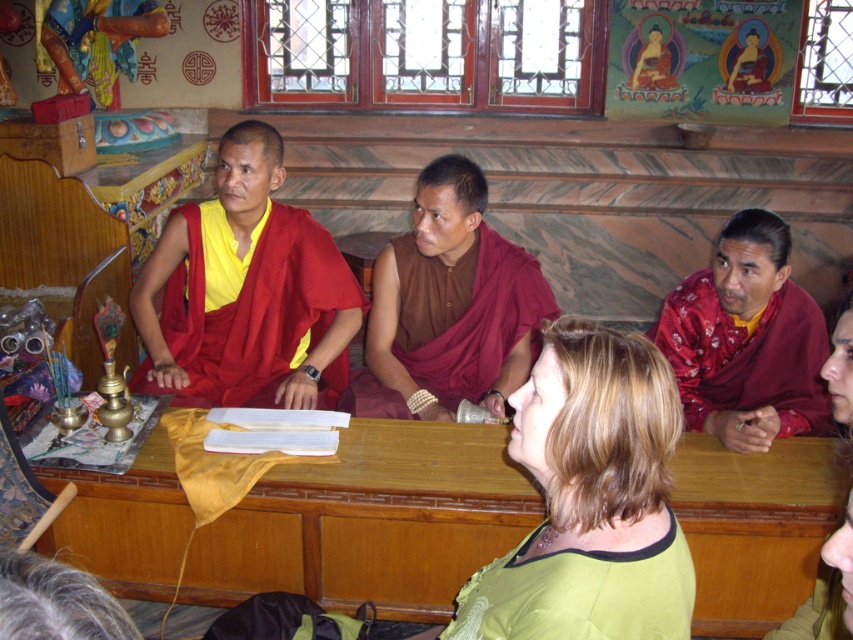
Question: Which object appears closest to the camera in this image?

Choices:
 (A) brown silk robe at center
 (B) red silk robe at right
 (C) matte red robe at center
 (D) wooden table at center

Answer: (D)

Question: Does wooden table at center appear on the left side of matte red robe at center?

Choices:
 (A) no
 (B) yes

Answer: (A)

Question: Which point is farther to the camera?

Choices:
 (A) (735, 349)
 (B) (675, 496)
 (C) (289, 344)
 (D) (412, 340)

Answer: (D)

Question: Can you confirm if red silk robe at right is positioned below green silk blouse at lower center?

Choices:
 (A) no
 (B) yes

Answer: (A)

Question: Can you confirm if brown silk robe at center is thinner than green silk blouse at lower center?

Choices:
 (A) yes
 (B) no

Answer: (B)

Question: Which of the following is the farthest from the observer?

Choices:
 (A) matte red robe at center
 (B) green silk blouse at lower center
 (C) red silk robe at right

Answer: (A)